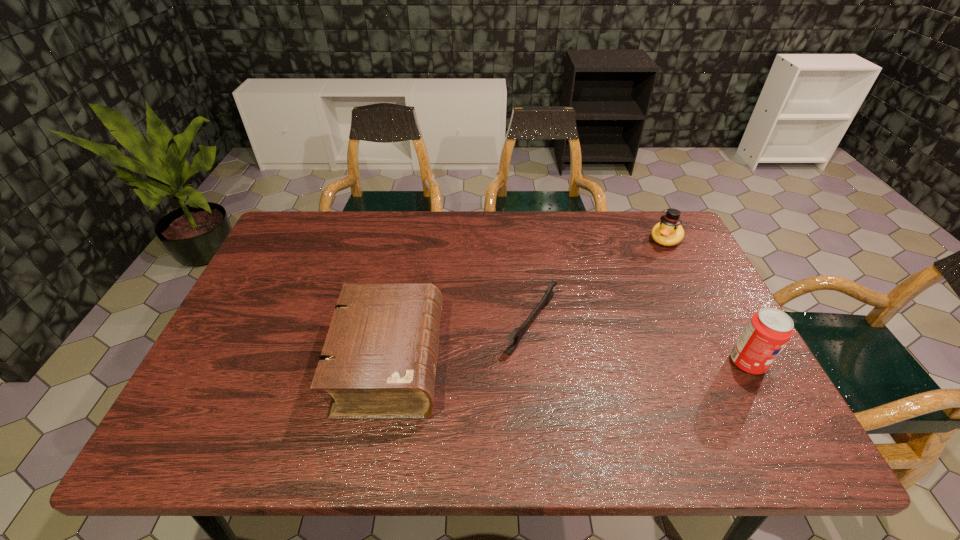
Where is `vacant area situated 0.070m on the front-facing side of the farthest object`? vacant area situated 0.070m on the front-facing side of the farthest object is located at coordinates (651, 260).

Identify the location of vacant area situated on the front-facing side of the farthest object. (615, 308).

You are a GUI agent. You are given a task and a screenshot of the screen. Output one action in this format:
    pyautogui.click(x=<x>, y=<y>)
    Task: Click on the object that is at the far edge
    This screenshot has height=540, width=960.
    Given the screenshot: What is the action you would take?
    pyautogui.click(x=668, y=232)

You are a GUI agent. You are given a task and a screenshot of the screen. Output one action in this format:
    pyautogui.click(x=<x>, y=<y>)
    Task: Click on the object located at the near edge
    The image size is (960, 540).
    Given the screenshot: What is the action you would take?
    pyautogui.click(x=379, y=360)

The width and height of the screenshot is (960, 540). What are the coordinates of `soda can positioned at the right edge` in the screenshot? It's located at (768, 331).

Identify the location of duck that is at the right edge. The width and height of the screenshot is (960, 540). (668, 232).

The height and width of the screenshot is (540, 960). Identify the location of object at the far right corner. [x=668, y=232].

Identify the location of free space at the far edge of the desktop. coord(518,215).

Locate an element on the screen. This screenshot has width=960, height=540. vacant area at the near edge of the desktop is located at coordinates (479, 379).

In the image, there is a desktop. Where is `vacant space at the left edge`? The image size is (960, 540). vacant space at the left edge is located at coordinates (275, 277).